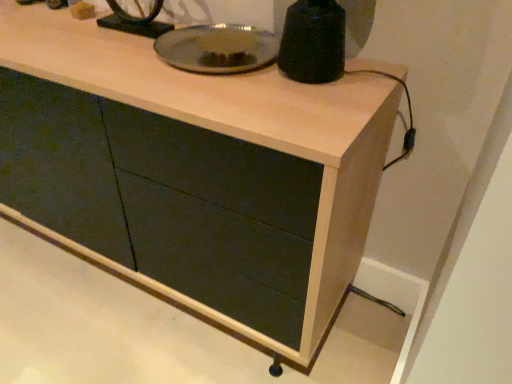
Locate an element on the screen. This screenshot has height=384, width=512. vacant area that is in front of shiny glass plate at center is located at coordinates (223, 99).